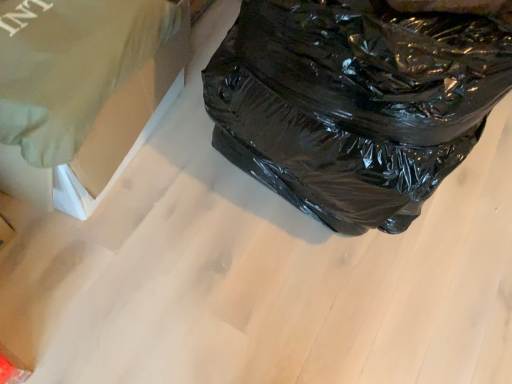
Question: Can you confirm if green fabric at upper left is wider than black plastic bag at right?

Choices:
 (A) no
 (B) yes

Answer: (A)

Question: Is green fabric at upper left at the left side of black plastic bag at right?

Choices:
 (A) no
 (B) yes

Answer: (B)

Question: Is green fabric at upper left further to the viewer compared to black plastic bag at right?

Choices:
 (A) yes
 (B) no

Answer: (A)

Question: Can you confirm if green fabric at upper left is positioned to the right of black plastic bag at right?

Choices:
 (A) yes
 (B) no

Answer: (B)

Question: From the image's perspective, is green fabric at upper left under black plastic bag at right?

Choices:
 (A) yes
 (B) no

Answer: (A)

Question: Is green fabric at upper left beside black plastic bag at right?

Choices:
 (A) no
 (B) yes

Answer: (A)

Question: Considering the relative positions of black plastic bag at right and green fabric at upper left in the image provided, is black plastic bag at right in front of green fabric at upper left?

Choices:
 (A) no
 (B) yes

Answer: (B)

Question: Is black plastic bag at right shorter than green fabric at upper left?

Choices:
 (A) yes
 (B) no

Answer: (B)

Question: Is black plastic bag at right thinner than green fabric at upper left?

Choices:
 (A) yes
 (B) no

Answer: (B)

Question: Does black plastic bag at right have a greater height compared to green fabric at upper left?

Choices:
 (A) yes
 (B) no

Answer: (A)

Question: From the image's perspective, is black plastic bag at right above green fabric at upper left?

Choices:
 (A) no
 (B) yes

Answer: (B)

Question: Is black plastic bag at right oriented towards green fabric at upper left?

Choices:
 (A) yes
 (B) no

Answer: (B)

Question: Is green fabric at upper left taller or shorter than black plastic bag at right?

Choices:
 (A) tall
 (B) short

Answer: (B)